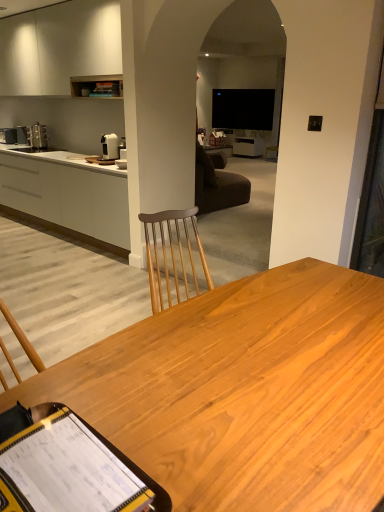
Question: Considering the relative sizes of white matte cabinetry at left, the 1th cabinetry when ordered from bottom to top, and yellow plastic clipboard at lower left in the image provided, is white matte cabinetry at left, the 1th cabinetry when ordered from bottom to top, taller than yellow plastic clipboard at lower left?

Choices:
 (A) yes
 (B) no

Answer: (A)

Question: Is white matte cabinetry at left, the 1th cabinetry when ordered from bottom to top, shorter than yellow plastic clipboard at lower left?

Choices:
 (A) yes
 (B) no

Answer: (B)

Question: From the image's perspective, is white matte cabinetry at left, the 2th cabinetry when ordered from top to bottom, over yellow plastic clipboard at lower left?

Choices:
 (A) no
 (B) yes

Answer: (B)

Question: Is white matte cabinetry at left, the 2th cabinetry when ordered from top to bottom, looking in the opposite direction of yellow plastic clipboard at lower left?

Choices:
 (A) no
 (B) yes

Answer: (A)

Question: From the image's perspective, is white matte cabinetry at left, the 1th cabinetry when ordered from bottom to top, located beneath yellow plastic clipboard at lower left?

Choices:
 (A) yes
 (B) no

Answer: (B)

Question: Is white matte cabinetry at left, the 1th cabinetry when ordered from bottom to top, bigger than yellow plastic clipboard at lower left?

Choices:
 (A) no
 (B) yes

Answer: (B)

Question: Is yellow plastic clipboard at lower left positioned far away from white matte cabinetry at left, the 1th cabinetry when ordered from bottom to top?

Choices:
 (A) yes
 (B) no

Answer: (A)

Question: From a real-world perspective, does yellow plastic clipboard at lower left stand above white matte cabinetry at left, the 1th cabinetry when ordered from bottom to top?

Choices:
 (A) yes
 (B) no

Answer: (A)

Question: Considering the relative positions of yellow plastic clipboard at lower left and white matte cabinetry at left, the 2th cabinetry when ordered from top to bottom, in the image provided, is yellow plastic clipboard at lower left to the left of white matte cabinetry at left, the 2th cabinetry when ordered from top to bottom, from the viewer's perspective?

Choices:
 (A) no
 (B) yes

Answer: (A)

Question: Can you confirm if yellow plastic clipboard at lower left is taller than white matte cabinetry at left, the 2th cabinetry when ordered from top to bottom?

Choices:
 (A) no
 (B) yes

Answer: (A)

Question: Does yellow plastic clipboard at lower left have a smaller size compared to white matte cabinetry at left, the 2th cabinetry when ordered from top to bottom?

Choices:
 (A) no
 (B) yes

Answer: (B)

Question: Could you tell me if yellow plastic clipboard at lower left is facing white matte cabinetry at left, the 2th cabinetry when ordered from top to bottom?

Choices:
 (A) yes
 (B) no

Answer: (A)

Question: From a real-world perspective, does white matte cabinet at upper left, the second cabinetry in the bottom-to-top sequence, sit lower than white matte cabinetry at left, the 2th cabinetry when ordered from top to bottom?

Choices:
 (A) no
 (B) yes

Answer: (A)